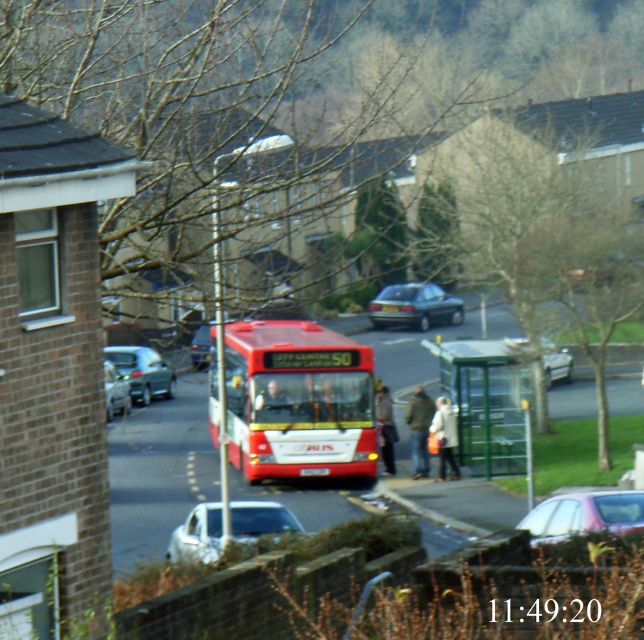
You are standing at the bus stop and want to walk to the point marked as point (120,397). Which direction should you move relative to the other point point (386,403)?

You should move downward relative to point (386,403) to reach point (120,397) since it is located below it.

You are a delivery person who needs to load a tall package into your vehicle. You see a white matte car at lower center and a silver metallic hatchback at left. Which vehicle has enough clearance to accommodate the tall package?

The silver metallic hatchback at left has a greater height than the white matte car at lower center, so it can accommodate the tall package.

You are a delivery person who needs to load a tall package into your vehicle. You see the red matte bus at center and the white matte car at lower center in the scene. Which vehicle should you choose to load the package into if you want to avoid the package touching the roof?

The red matte bus at center has a greater height compared to the white matte car at lower center, so you should choose the red matte bus at center to load the tall package to prevent it from touching the roof.